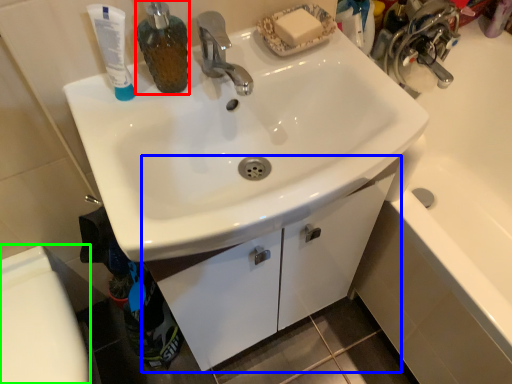
Question: Which object is the closest to the soap dispenser (highlighted by a red box)? Choose among these: bathroom cabinet (highlighted by a blue box) or toilet bowl (highlighted by a green box).

Choices:
 (A) bathroom cabinet
 (B) toilet bowl

Answer: (A)